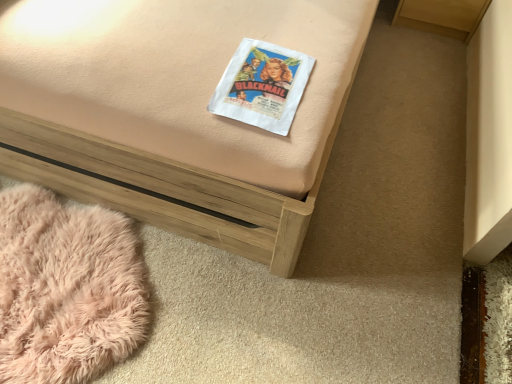
The height and width of the screenshot is (384, 512). What are the coordinates of `fluffy pink rug at lower left` in the screenshot? It's located at (67, 289).

Based on the photo, is fluffy pink rug at lower left positioned beyond the bounds of matte paper book at center?

Yes.

Based on their positions, is fluffy pink rug at lower left located to the left or right of matte paper book at center?

fluffy pink rug at lower left is to the left of matte paper book at center.

Considering their positions, is fluffy pink rug at lower left located in front of or behind matte paper book at center?

Clearly, fluffy pink rug at lower left is behind matte paper book at center.

From the image's perspective, who appears lower, fluffy pink rug at lower left or matte paper book at center?

fluffy pink rug at lower left.

Is fluffy pink rug at lower left wider or thinner than wooden bed frame at center?

Clearly, fluffy pink rug at lower left has less width compared to wooden bed frame at center.

Locate an element on the screen. This screenshot has height=384, width=512. blanket behind the wooden bed frame at center is located at coordinates (67, 289).

Which is less distant, (15, 238) or (53, 68)?

The point (53, 68) is more forward.

In the scene shown: Between matte paper book at center and wooden bed frame at center, which one has smaller size?

Smaller between the two is matte paper book at center.

From the image's perspective, which is above, matte paper book at center or wooden bed frame at center?

wooden bed frame at center, from the image's perspective.

Which object is more forward, matte paper book at center or wooden bed frame at center?

wooden bed frame at center is more forward.

From a real-world perspective, is matte paper book at center physically located above or below wooden bed frame at center?

matte paper book at center is above wooden bed frame at center.

In order to click on blanket below the matte paper book at center (from a real-world perspective) in this screenshot , I will do `click(67, 289)`.

Is matte paper book at center at the right side of fluffy pink rug at lower left?

Yes, matte paper book at center is to the right of fluffy pink rug at lower left.

From a real-world perspective, is matte paper book at center below fluffy pink rug at lower left?

Incorrect, from a real-world perspective, matte paper book at center is higher than fluffy pink rug at lower left.

Which is behind, wooden bed frame at center or fluffy pink rug at lower left?

fluffy pink rug at lower left is further away from the camera.

Who is taller, wooden bed frame at center or fluffy pink rug at lower left?

Standing taller between the two is wooden bed frame at center.

Looking at this image, from the image's perspective, which object appears higher, wooden bed frame at center or matte paper book at center?

wooden bed frame at center, from the image's perspective.

In the scene shown: From a real-world perspective, is wooden bed frame at center over matte paper book at center?

No, from a real-world perspective, wooden bed frame at center is not above matte paper book at center.

Can you confirm if wooden bed frame at center is thinner than matte paper book at center?

In fact, wooden bed frame at center might be wider than matte paper book at center.

Is matte paper book at center located within wooden bed frame at center?

Absolutely, matte paper book at center is inside wooden bed frame at center.

Identify the location of paperback book on the right of fluffy pink rug at lower left. This screenshot has height=384, width=512. (262, 86).

The width and height of the screenshot is (512, 384). In order to click on blanket that is on the left side of wooden bed frame at center in this screenshot , I will do `click(67, 289)`.

From the picture: When comparing their distances from matte paper book at center, does wooden bed frame at center or fluffy pink rug at lower left seem closer?

wooden bed frame at center is closer to matte paper book at center.

When comparing their distances from wooden bed frame at center, does fluffy pink rug at lower left or matte paper book at center seem further?

Based on the image, fluffy pink rug at lower left appears to be further to wooden bed frame at center.

Based on their spatial positions, is matte paper book at center or fluffy pink rug at lower left closer to wooden bed frame at center?

matte paper book at center is positioned closer to the anchor wooden bed frame at center.

Estimate the real-world distances between objects in this image. Which object is closer to matte paper book at center, fluffy pink rug at lower left or wooden bed frame at center?

wooden bed frame at center.

Considering their positions, is wooden bed frame at center positioned further to fluffy pink rug at lower left than matte paper book at center?

The object further to fluffy pink rug at lower left is matte paper book at center.

Estimate the real-world distances between objects in this image. Which object is closer to fluffy pink rug at lower left, matte paper book at center or wooden bed frame at center?

wooden bed frame at center.

Image resolution: width=512 pixels, height=384 pixels. In order to click on paperback book between wooden bed frame at center and fluffy pink rug at lower left in the up-down direction in this screenshot , I will do `click(262, 86)`.